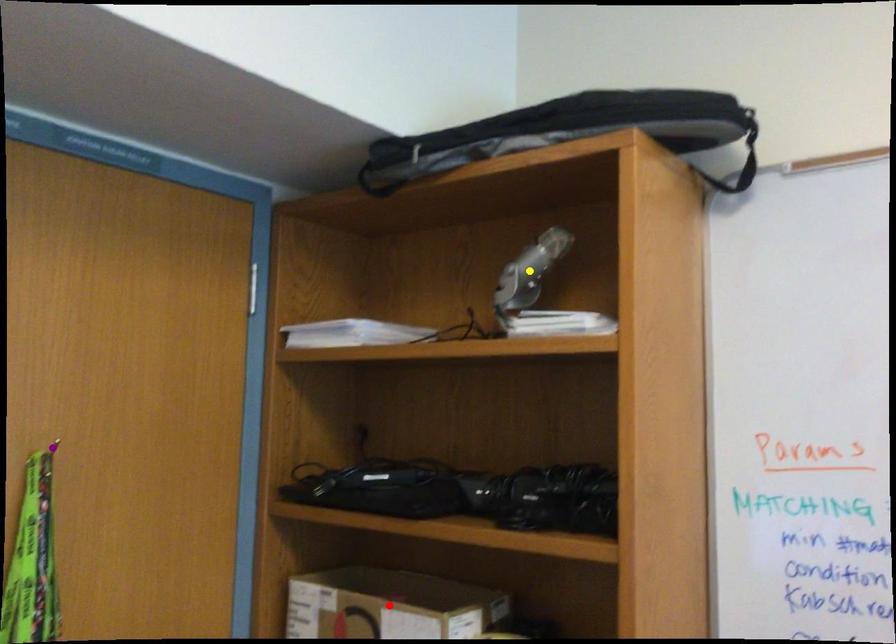
Order these from nearest to farthest:
1. yellow point
2. red point
3. purple point

purple point < yellow point < red point